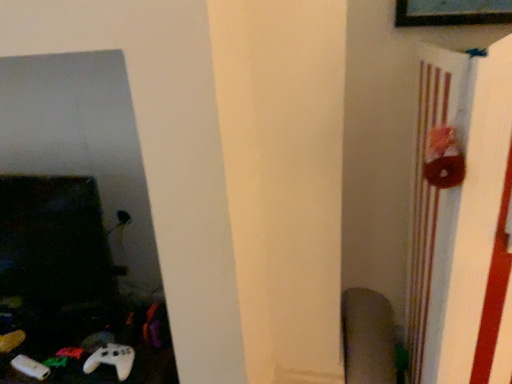
Question: Is brown fabric bulletin board at right to the left of velvet-like gray swivel chair at lower right from the viewer's perspective?

Choices:
 (A) no
 (B) yes

Answer: (A)

Question: Is brown fabric bulletin board at right bigger than velvet-like gray swivel chair at lower right?

Choices:
 (A) no
 (B) yes

Answer: (B)

Question: Is brown fabric bulletin board at right thinner than velvet-like gray swivel chair at lower right?

Choices:
 (A) no
 (B) yes

Answer: (A)

Question: From a real-world perspective, is brown fabric bulletin board at right on top of velvet-like gray swivel chair at lower right?

Choices:
 (A) no
 (B) yes

Answer: (B)

Question: Is brown fabric bulletin board at right facing away from velvet-like gray swivel chair at lower right?

Choices:
 (A) yes
 (B) no

Answer: (B)

Question: Is brown fabric bulletin board at right oriented towards velvet-like gray swivel chair at lower right?

Choices:
 (A) yes
 (B) no

Answer: (B)

Question: Can you confirm if velvet-like gray swivel chair at lower right is positioned to the left of white matte game controller at lower left?

Choices:
 (A) yes
 (B) no

Answer: (B)

Question: From a real-world perspective, is velvet-like gray swivel chair at lower right on white matte game controller at lower left?

Choices:
 (A) yes
 (B) no

Answer: (B)

Question: From the image's perspective, is velvet-like gray swivel chair at lower right under white matte game controller at lower left?

Choices:
 (A) no
 (B) yes

Answer: (B)

Question: Is velvet-like gray swivel chair at lower right at the right side of white matte game controller at lower left?

Choices:
 (A) no
 (B) yes

Answer: (B)

Question: Could you tell me if velvet-like gray swivel chair at lower right is facing white matte game controller at lower left?

Choices:
 (A) no
 (B) yes

Answer: (A)

Question: Does velvet-like gray swivel chair at lower right lie in front of white matte game controller at lower left?

Choices:
 (A) yes
 (B) no

Answer: (B)

Question: From the image's perspective, is velvet-like gray swivel chair at lower right on brown fabric bulletin board at right?

Choices:
 (A) yes
 (B) no

Answer: (B)